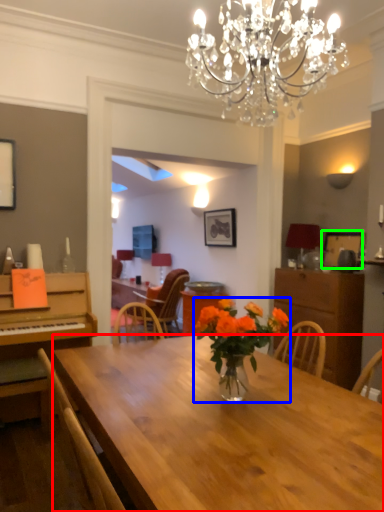
Question: Which is farther away from desk (highlighted by a red box)? houseplant (highlighted by a blue box) or picture frame (highlighted by a green box)?

Choices:
 (A) houseplant
 (B) picture frame

Answer: (B)